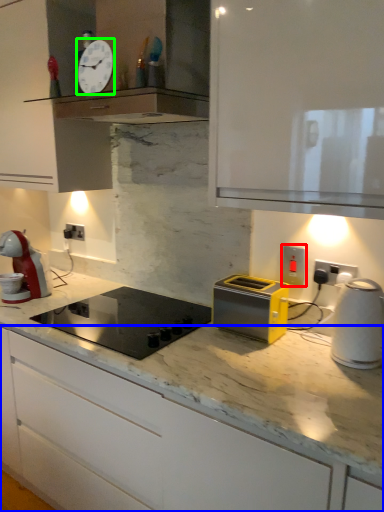
Question: Which object is the closest to the electric outlet (highlighted by a red box)? Choose among these: cabinetry (highlighted by a blue box) or clock (highlighted by a green box).

Choices:
 (A) cabinetry
 (B) clock

Answer: (A)